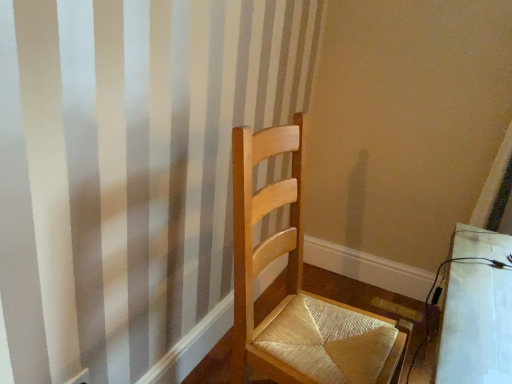
Find the location of a particular element. light wood chair at center is located at coordinates (297, 288).

What do you see at coordinates (297, 288) in the screenshot?
I see `light wood chair at center` at bounding box center [297, 288].

Identify the location of light wood chair at center. Image resolution: width=512 pixels, height=384 pixels. (297, 288).